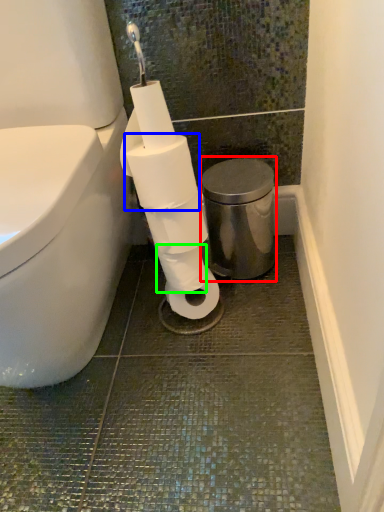
Question: Which object is the farthest from bidet (highlighted by a red box)? Choose among these: toilet paper (highlighted by a blue box) or toilet paper (highlighted by a green box).

Choices:
 (A) toilet paper
 (B) toilet paper

Answer: (A)